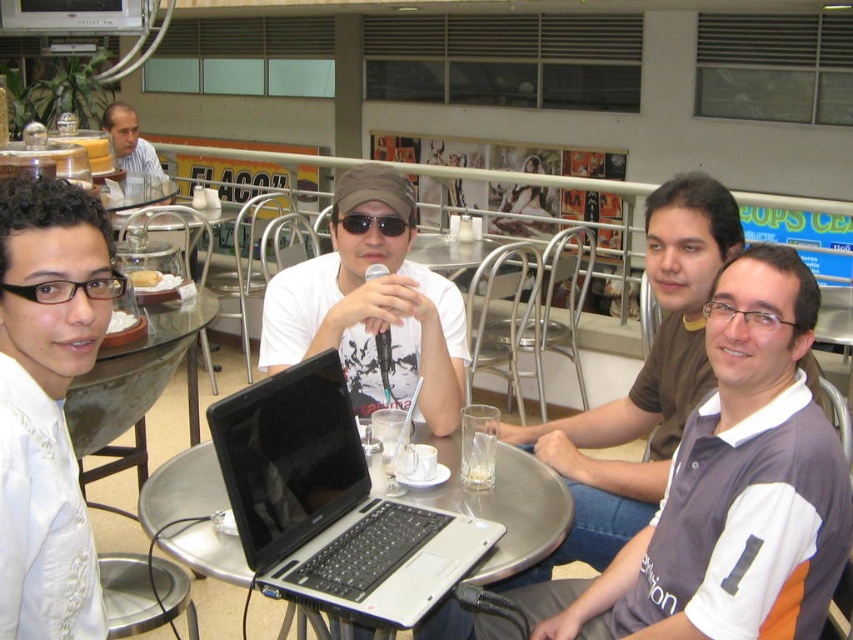
Does point (61, 604) lie behind point (364, 227)?

No.

Is point (15, 227) closer to viewer compared to point (337, 216)?

Yes, point (15, 227) is in front of point (337, 216).

Is point (10, 326) behind point (397, 234)?

No, it is in front of (397, 234).

Locate an element on the screen. white satin shirt at left is located at coordinates (47, 403).

Does silver/black laptop at center have a smaller size compared to light brown shirt at upper left?

Correct, silver/black laptop at center occupies less space than light brown shirt at upper left.

At what (x,y) coordinates should I click in order to perform the action: click on silver/black laptop at center. Please return your answer as a coordinate pair (x, y). Looking at the image, I should click on (335, 509).

At what (x,y) coordinates should I click in order to perform the action: click on silver/black laptop at center. Please return your answer as a coordinate pair (x, y). This screenshot has width=853, height=640. Looking at the image, I should click on (335, 509).

Who is more distant from viewer, (566, 456) or (480, 464)?

The point (566, 456) is behind.

Is gray fabric shirt at upper right above clear glass at table center?

Indeed, gray fabric shirt at upper right is positioned over clear glass at table center.

Locate an element on the screen. gray fabric shirt at upper right is located at coordinates (642, 380).